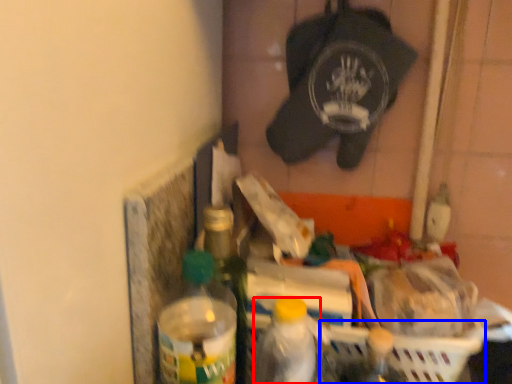
Question: Among these objects, which one is farthest to the camera, bottle (highlighted by a red box) or basket (highlighted by a blue box)?

Choices:
 (A) bottle
 (B) basket

Answer: (B)